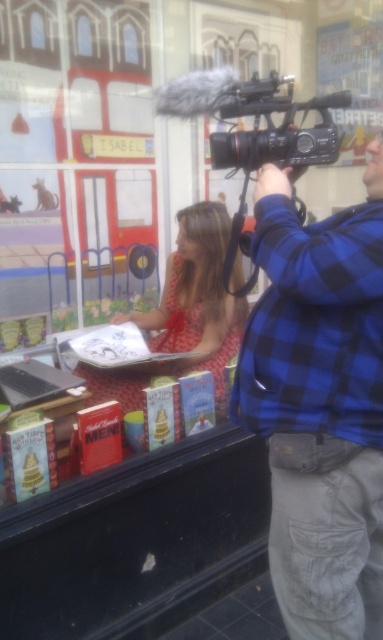
Between point (332, 285) and point (289, 97), which one is positioned behind?

Point (289, 97)

Find the location of a particular element. This screenshot has width=383, height=640. blue checkered shirt at upper right is located at coordinates (314, 324).

Does point (276, 316) come behind point (212, 145)?

No.

Image resolution: width=383 pixels, height=640 pixels. I want to click on blue checkered shirt at upper right, so click(314, 324).

Who is more distant from viewer, [366,285] or [158,326]?

Point [158,326]

Is blue plaid shirt at upper right wider than matte red dress at center?

In fact, blue plaid shirt at upper right might be narrower than matte red dress at center.

Is point (327, 237) positioned after point (209, 252)?

No, (327, 237) is closer to viewer.

Find the location of a particular element. blue plaid shirt at upper right is located at coordinates (320, 404).

Can you confirm if blue plaid shirt at upper right is taller than blue checkered shirt at upper right?

Correct, blue plaid shirt at upper right is much taller as blue checkered shirt at upper right.

Between point (364, 173) and point (381, 349), which one is positioned behind?

The point (364, 173) is more distant.

Locate an element on the screen. The image size is (383, 640). blue plaid shirt at upper right is located at coordinates (320, 404).

At what (x,y) coordinates should I click in order to perform the action: click on blue plaid shirt at upper right. Please return your answer as a coordinate pair (x, y). The height and width of the screenshot is (640, 383). Looking at the image, I should click on (320, 404).